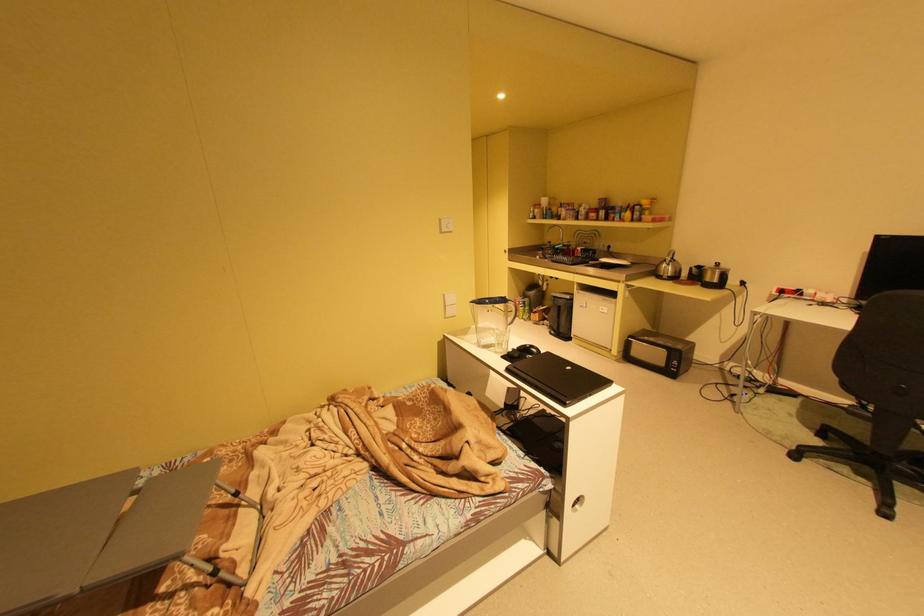
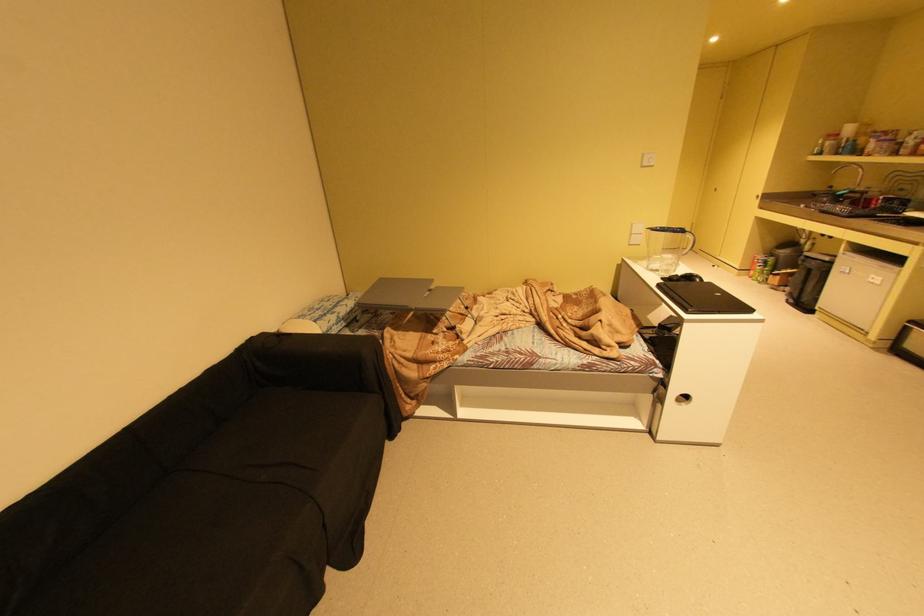
In the second image, find the point that corresponds to point (493, 351) in the first image.

(659, 273)